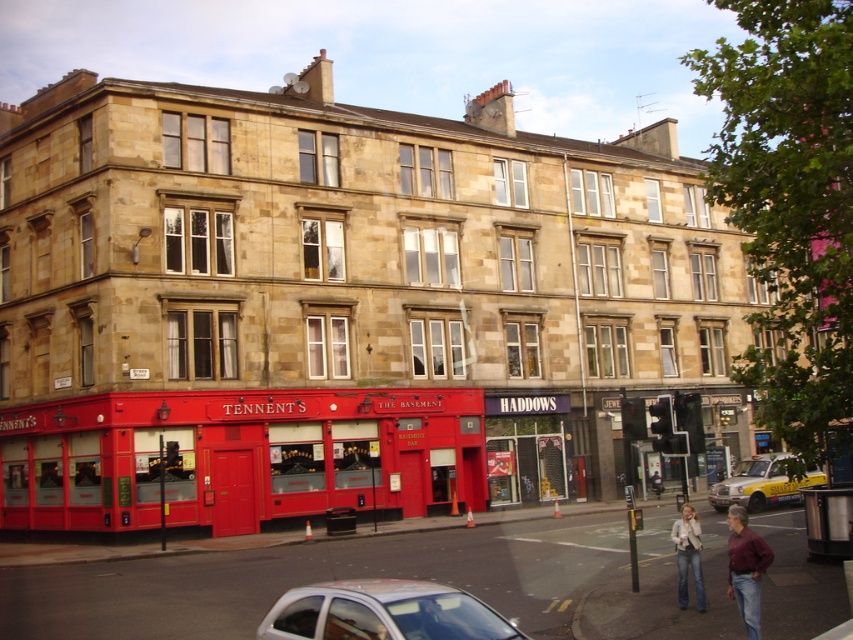
Question: Which of these objects is positioned closest to the red painted bus at lower center?

Choices:
 (A) yellow metallic taxi at lower right
 (B) maroon cotton shirt at lower right

Answer: (A)

Question: Estimate the real-world distances between objects in this image. Which object is closer to the red painted bus at lower center?

Choices:
 (A) denim jacket at lower right
 (B) yellow metallic taxi at lower right
 (C) white glossy car at lower center

Answer: (A)

Question: Which of the following is the closest to the observer?

Choices:
 (A) (773, 496)
 (B) (16, 496)

Answer: (A)

Question: Does red painted bus at lower center have a smaller size compared to maroon cotton shirt at lower right?

Choices:
 (A) no
 (B) yes

Answer: (A)

Question: From the image, what is the correct spatial relationship of white glossy car at lower center in relation to denim jacket at lower right?

Choices:
 (A) left
 (B) right

Answer: (A)

Question: From the image, what is the correct spatial relationship of red painted bus at lower center in relation to denim jacket at lower right?

Choices:
 (A) left
 (B) right

Answer: (A)